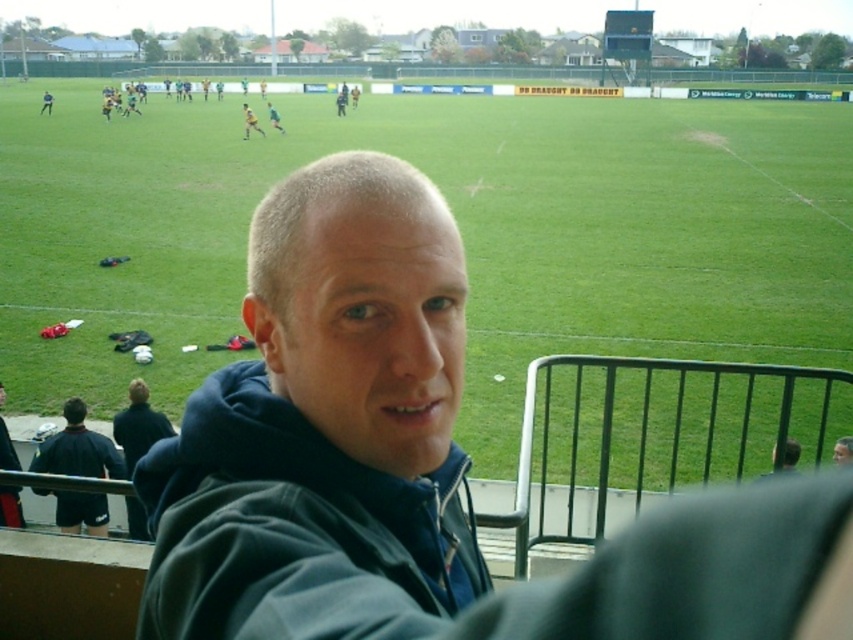
You are standing at the point labeled point [141,529] and want to walk to the point labeled point [268,109]. Given that both points are on the field, which direction should you move relative to your current position?

You should move towards the direction away from the camera because point [268,109] is further away from the camera compared to your current position at point [141,529].

You are a photographer at the sports field. You need to capture a photo that includes both the black fleece jacket at lower left and the green jersey at center. What is the minimum distance you need to move backward from the current position to ensure both objects are in frame?

The black fleece jacket at lower left and green jersey at center are 138.79 feet apart. To include both in the frame, you need to move backward until your camera can capture a field of view that spans at least 138.79 feet between them.